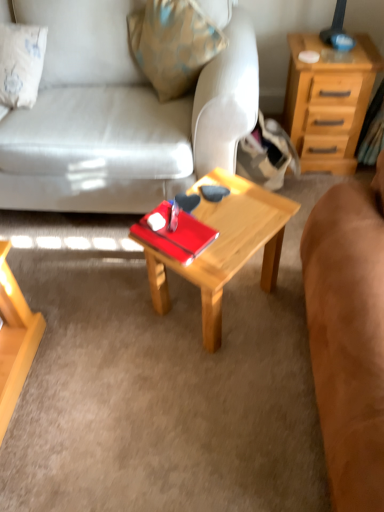
Locate an element on the screen. The image size is (384, 512). free spot in front of wooden coffee table at center is located at coordinates (222, 386).